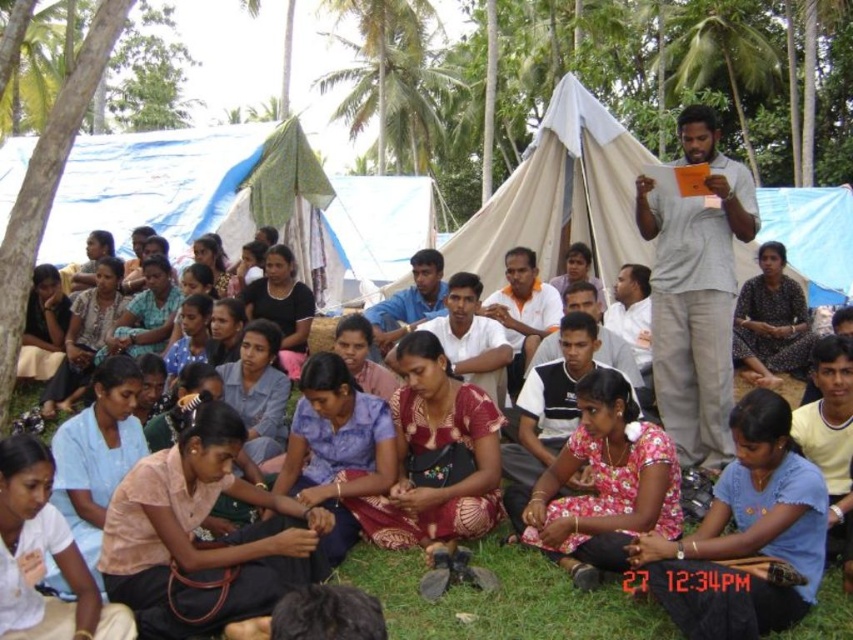
You are standing at the origin point in the image. Where is the white canvas tent at center located in terms of coordinates?

The white canvas tent at center is located at coordinates point (560, 196).

You are planning to set up a small picnic area in the middle of the gathering. The picnic blanket you have is the same size as the floral fabric dress at center. Can you fit the picnic blanket under the white canvas tent at center without it being too cramped?

The white canvas tent at center has a larger width than the floral fabric dress at center, so the picnic blanket, which is the same size as the floral fabric dress at center, will fit comfortably under the white canvas tent at center without being cramped.